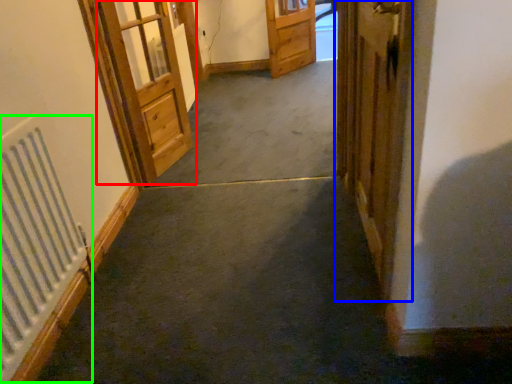
Question: Based on their relative distances, which object is nearer to door (highlighted by a red box)? Choose from door (highlighted by a blue box) and radiator (highlighted by a green box).

Choices:
 (A) door
 (B) radiator

Answer: (B)